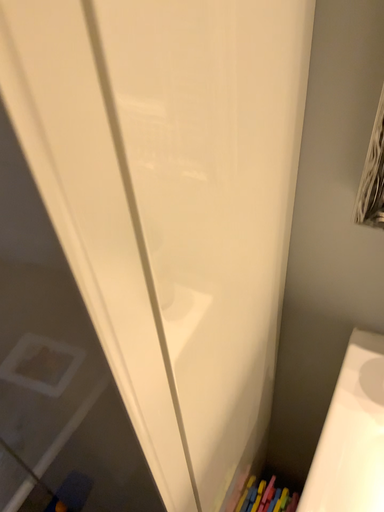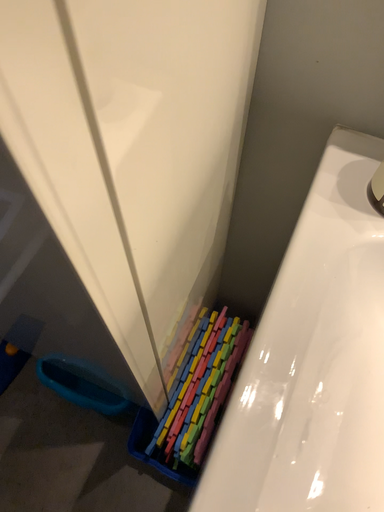
Question: How did the camera likely rotate when shooting the video?

Choices:
 (A) rotated right
 (B) rotated left

Answer: (A)